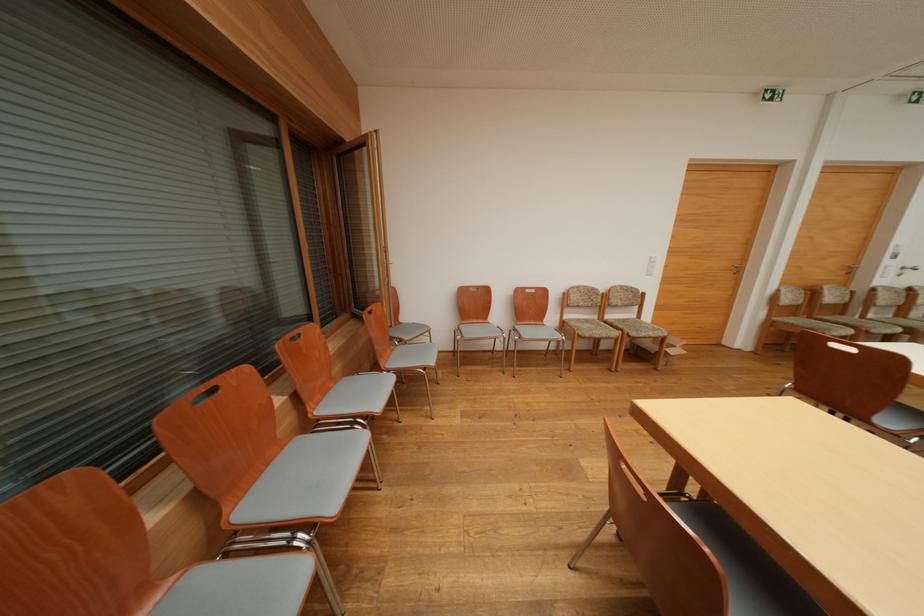
Image resolution: width=924 pixels, height=616 pixels. What do you see at coordinates (650, 265) in the screenshot? I see `the white light switch` at bounding box center [650, 265].